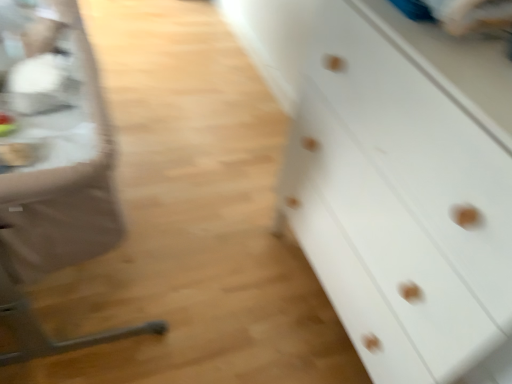
Question: Does metallic silver table at left appear on the left side of metallic silver feeding chair at left?

Choices:
 (A) no
 (B) yes

Answer: (B)

Question: Are metallic silver table at left and metallic silver feeding chair at left beside each other?

Choices:
 (A) yes
 (B) no

Answer: (A)

Question: Considering the relative sizes of metallic silver table at left and metallic silver feeding chair at left in the image provided, is metallic silver table at left bigger than metallic silver feeding chair at left?

Choices:
 (A) no
 (B) yes

Answer: (A)

Question: From the image's perspective, is metallic silver table at left over metallic silver feeding chair at left?

Choices:
 (A) yes
 (B) no

Answer: (A)

Question: Is metallic silver table at left at the right side of metallic silver feeding chair at left?

Choices:
 (A) yes
 (B) no

Answer: (B)

Question: Looking at the image, does metallic silver table at left seem bigger or smaller compared to white matte chest of drawers at right?

Choices:
 (A) small
 (B) big

Answer: (A)

Question: From a real-world perspective, is metallic silver table at left positioned above or below white matte chest of drawers at right?

Choices:
 (A) below
 (B) above

Answer: (B)

Question: Do you think metallic silver table at left is within white matte chest of drawers at right, or outside of it?

Choices:
 (A) outside
 (B) inside

Answer: (A)

Question: Would you say metallic silver table at left is to the left or to the right of white matte chest of drawers at right in the picture?

Choices:
 (A) right
 (B) left

Answer: (B)

Question: Is metallic silver feeding chair at left inside or outside of white matte chest of drawers at right?

Choices:
 (A) outside
 (B) inside

Answer: (A)

Question: In the image, is metallic silver feeding chair at left positioned in front of or behind white matte chest of drawers at right?

Choices:
 (A) behind
 (B) front

Answer: (A)

Question: Considering the positions of metallic silver feeding chair at left and white matte chest of drawers at right in the image, is metallic silver feeding chair at left wider or thinner than white matte chest of drawers at right?

Choices:
 (A) thin
 (B) wide

Answer: (B)

Question: From a real-world perspective, is metallic silver feeding chair at left above or below white matte chest of drawers at right?

Choices:
 (A) above
 (B) below

Answer: (B)

Question: From a real-world perspective, is metallic silver table at left above or below metallic silver feeding chair at left?

Choices:
 (A) above
 (B) below

Answer: (A)

Question: In terms of width, does metallic silver table at left look wider or thinner when compared to metallic silver feeding chair at left?

Choices:
 (A) wide
 (B) thin

Answer: (B)